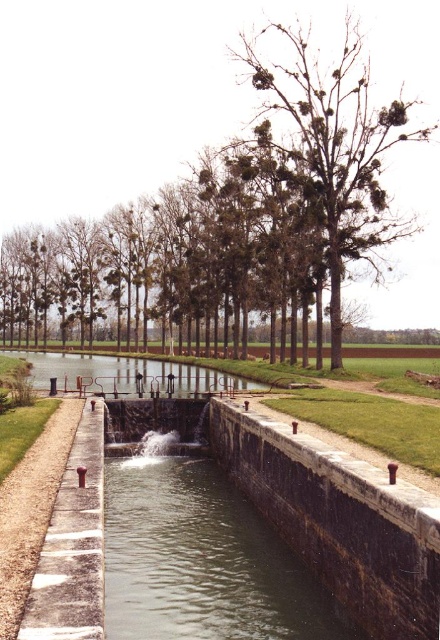
You are a boat operator navigating through the canal lock. You need to determine if your boat, which is 5 meters wide, can safely pass through the narrowest point between the clear water at lock center and the concrete sidewalk at lower left. Can it fit?

The clear water at lock center might be wider than concrete sidewalk at lower left, so it is uncertain if the boat can fit. Check the exact width before proceeding.

You are standing on the grassy path on the left side of the canal and want to cross to the right side. The brown leafless tree at center and the smooth concrete waterway at center are in your way. Which object should you move around to reach the other side?

You should move around the brown leafless tree at center because the smooth concrete waterway at center is behind it, so going around the tree would allow you to access the right side of the canal.

You are a drone operator trying to capture a closeup of the clear water at lock center. The camera has a 10cm margin of error. What is the best coordinate to aim for?

The best coordinate to aim for is the clear water at lock center, which is located at point (201, 561). Considering the camera has a 10cm margin of error, you should aim precisely at these coordinates to ensure the clearest possible image.